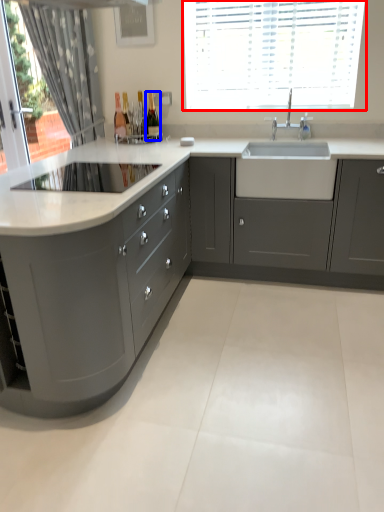
Question: Among these objects, which one is nearest to the camera, window (highlighted by a red box) or bottle (highlighted by a blue box)?

Choices:
 (A) window
 (B) bottle

Answer: (A)